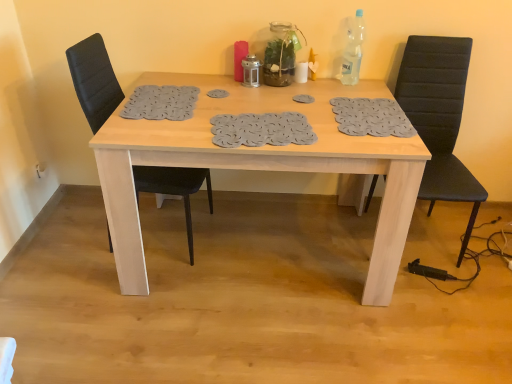
I want to click on free space that is to the left of black leather chair at left, positioned as the 1th chair in left-to-right order, so click(70, 241).